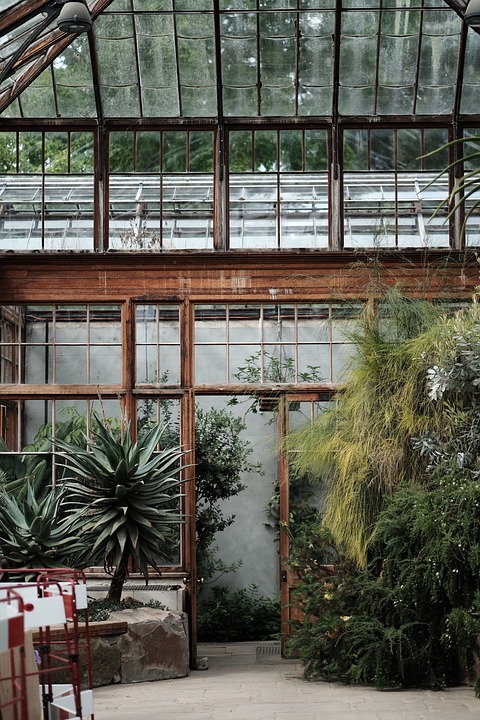
The height and width of the screenshot is (720, 480). I want to click on ceiling windows, so click(118, 63), click(244, 68), click(398, 62).